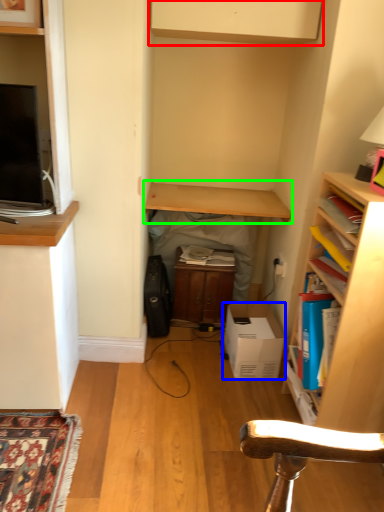
Question: Considering the real-world distances, which object is farthest from cabinetry (highlighted by a red box)? cardboard box (highlighted by a blue box) or table (highlighted by a green box)?

Choices:
 (A) cardboard box
 (B) table

Answer: (A)